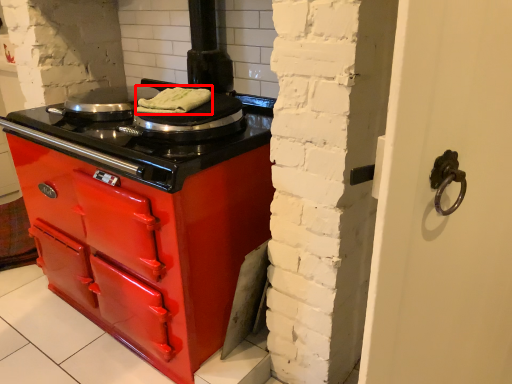
Question: From the image's perspective, where is food (annotated by the red box) located relative to kitchen appliance?

Choices:
 (A) below
 (B) above

Answer: (A)